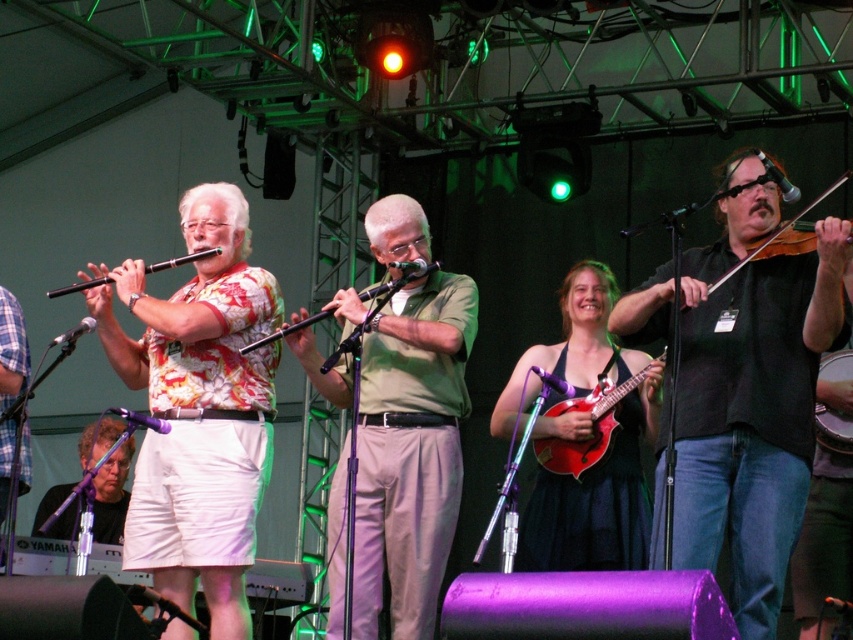
Question: Where is floral shirt at center located in relation to wooden drum at right in the image?

Choices:
 (A) left
 (B) right

Answer: (A)

Question: Can you confirm if matte black microphone at lower left is thinner than wooden violin at center?

Choices:
 (A) no
 (B) yes

Answer: (B)

Question: Which of the following is the farthest from the observer?

Choices:
 (A) black matte violin at center
 (B) floral shirt at center
 (C) wooden drum at right

Answer: (C)

Question: Is green matte flute at center to the left of matte black microphone at lower left from the viewer's perspective?

Choices:
 (A) no
 (B) yes

Answer: (A)

Question: Which object is closer to the camera taking this photo?

Choices:
 (A) matte black flute at left
 (B) black matte violin at center
 (C) wooden violin at right
 (D) matte purple dress at center

Answer: (C)

Question: Which of the following is the farthest from the observer?

Choices:
 (A) wooden violin at center
 (B) black matte violin at center
 (C) matte red mandolin at center
 (D) green matte flute at center

Answer: (C)